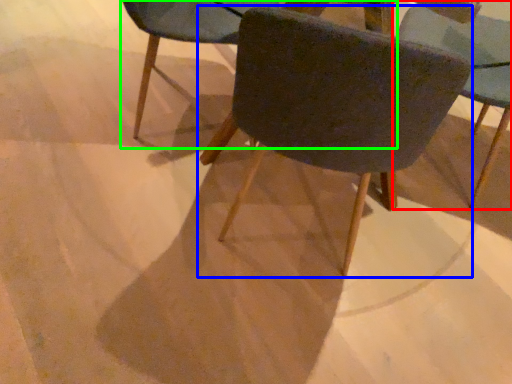
Question: Which object is the closest to the chair (highlighted by a red box)? Choose among these: chair (highlighted by a blue box) or chair (highlighted by a green box).

Choices:
 (A) chair
 (B) chair

Answer: (B)